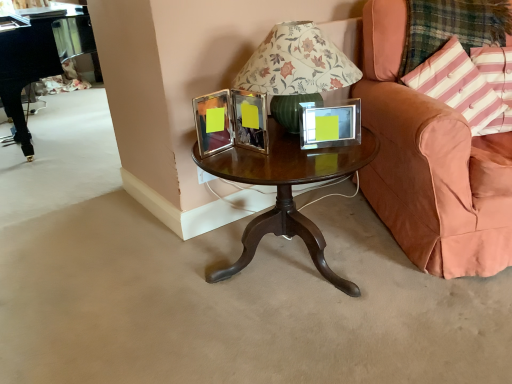
Find the location of a particular element. The height and width of the screenshot is (384, 512). free spot below mahogany wood coffee table at center (from a real-world perspective) is located at coordinates (295, 269).